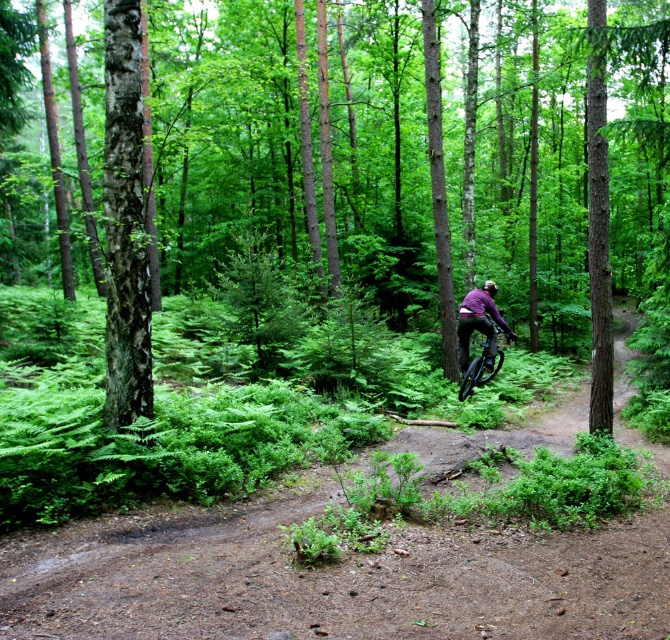
Question: Can you confirm if green bark tree at center is positioned to the right of matte purple helmet at center?

Choices:
 (A) yes
 (B) no

Answer: (B)

Question: Can you confirm if smooth bark tree at left is positioned to the left of shiny metallic bicycle at center-right?

Choices:
 (A) yes
 (B) no

Answer: (A)

Question: Which object is positioned farthest from the brown dirt track at center?

Choices:
 (A) shiny metallic bicycle at center-right
 (B) matte purple helmet at center

Answer: (B)

Question: Which is nearer to the smooth bark tree at left?

Choices:
 (A) matte purple helmet at center
 (B) brown dirt track at center

Answer: (B)

Question: Is shiny metallic bicycle at center-right positioned at the back of matte purple helmet at center?

Choices:
 (A) yes
 (B) no

Answer: (B)

Question: Among these objects, which one is nearest to the camera?

Choices:
 (A) green bark tree at center
 (B) matte purple helmet at center

Answer: (A)